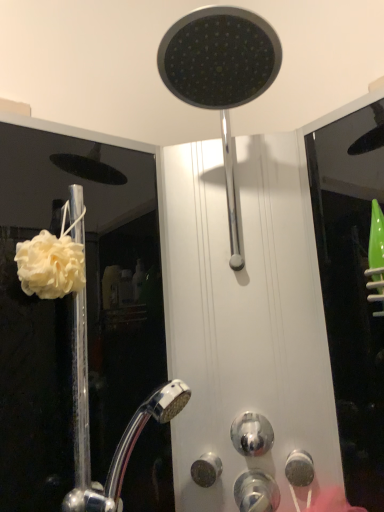
Question: Does shiny metallic knob at center, the 2th knob when ordered from left to right, appear on the right side of white matte shower curtain at left?

Choices:
 (A) no
 (B) yes

Answer: (B)

Question: Is shiny metallic knob at center, the 2th knob when ordered from left to right, positioned before white matte shower curtain at left?

Choices:
 (A) yes
 (B) no

Answer: (B)

Question: Considering the relative sizes of shiny metallic knob at center, which is the second knob from right to left, and white matte shower curtain at left in the image provided, is shiny metallic knob at center, which is the second knob from right to left, smaller than white matte shower curtain at left?

Choices:
 (A) yes
 (B) no

Answer: (A)

Question: From the image's perspective, is shiny metallic knob at center, the 2th knob when ordered from left to right, located beneath white matte shower curtain at left?

Choices:
 (A) no
 (B) yes

Answer: (B)

Question: Is shiny metallic knob at center, which is the second knob from right to left, not near white matte shower curtain at left?

Choices:
 (A) no
 (B) yes

Answer: (A)

Question: Is shiny metallic knob at center, the 2th knob when ordered from left to right, further to camera compared to white matte shower curtain at left?

Choices:
 (A) yes
 (B) no

Answer: (A)

Question: Does matte black shower head at upper center lie behind satin nickel knob at lower center, marked as the first knob in a left-to-right arrangement?

Choices:
 (A) no
 (B) yes

Answer: (A)

Question: Does matte black shower head at upper center lie in front of satin nickel knob at lower center, arranged as the 3th knob when viewed from the right?

Choices:
 (A) no
 (B) yes

Answer: (B)

Question: Considering the relative positions of matte black shower head at upper center and satin nickel knob at lower center, arranged as the 3th knob when viewed from the right, in the image provided, is matte black shower head at upper center to the right of satin nickel knob at lower center, arranged as the 3th knob when viewed from the right, from the viewer's perspective?

Choices:
 (A) no
 (B) yes

Answer: (B)

Question: Is matte black shower head at upper center taller than satin nickel knob at lower center, arranged as the 3th knob when viewed from the right?

Choices:
 (A) no
 (B) yes

Answer: (B)

Question: Is matte black shower head at upper center with satin nickel knob at lower center, marked as the first knob in a left-to-right arrangement?

Choices:
 (A) yes
 (B) no

Answer: (B)

Question: Is matte black shower head at upper center not inside satin nickel knob at lower center, arranged as the 3th knob when viewed from the right?

Choices:
 (A) yes
 (B) no

Answer: (A)

Question: Considering the relative sizes of white fluffy sponge at left and satin nickel knob at lower center, marked as the first knob in a left-to-right arrangement, in the image provided, is white fluffy sponge at left smaller than satin nickel knob at lower center, marked as the first knob in a left-to-right arrangement,?

Choices:
 (A) yes
 (B) no

Answer: (B)